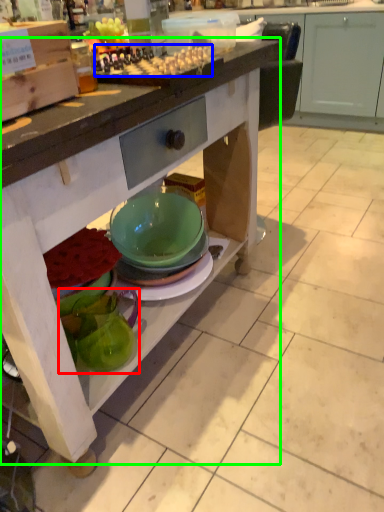
Question: Which object is the closest to the tableware (highlighted by a red box)? Choose among these: food (highlighted by a blue box) or table (highlighted by a green box).

Choices:
 (A) food
 (B) table

Answer: (B)